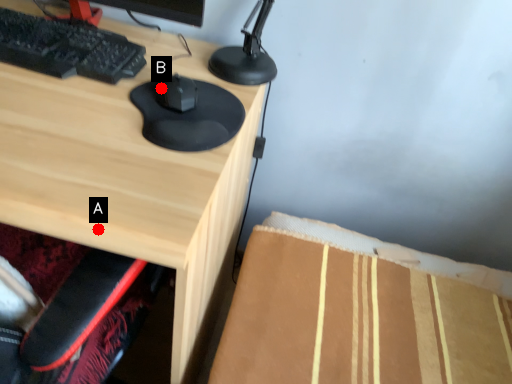
Question: Two points are circled on the image, labeled by A and B beside each circle. Which point is closer to the camera?

Choices:
 (A) A is closer
 (B) B is closer

Answer: (A)